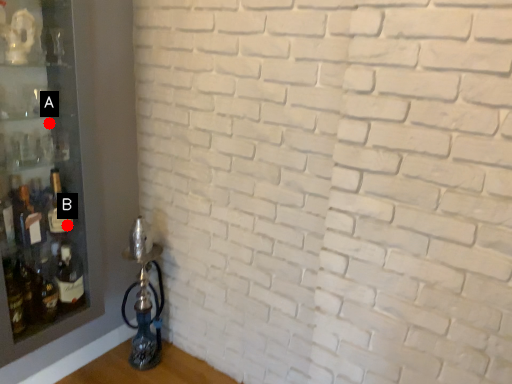
Question: Two points are circled on the image, labeled by A and B beside each circle. Which point is closer to the camera?

Choices:
 (A) A is closer
 (B) B is closer

Answer: (A)